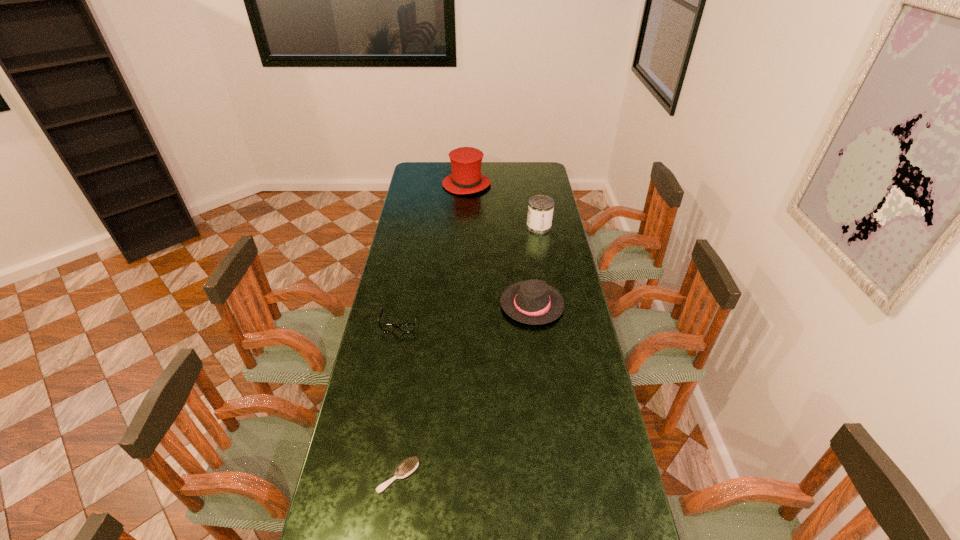
You are a GUI agent. You are given a task and a screenshot of the screen. Output one action in this format:
    pyautogui.click(x=<x>, y=<y>)
    Task: Click on the taller dress hat
    
    Given the screenshot: What is the action you would take?
    pyautogui.click(x=466, y=178)

Locate an element on the screen. the left dress hat is located at coordinates (466, 178).

The height and width of the screenshot is (540, 960). I want to click on the fourth nearest object, so click(x=540, y=208).

Locate an element on the screen. can is located at coordinates (540, 208).

Locate an element on the screen. The height and width of the screenshot is (540, 960). the third shortest object is located at coordinates (534, 302).

What are the coordinates of `the nearer dress hat` in the screenshot? It's located at (534, 302).

Identify the location of sunglasses. (385, 327).

Find the location of a particular element. This screenshot has width=960, height=540. scrubbing brush is located at coordinates (406, 468).

This screenshot has height=540, width=960. In order to click on the shortest object in this screenshot , I will do `click(406, 468)`.

In order to click on vacant space located 0.210m on the right of the farthest object in this screenshot , I will do `click(529, 184)`.